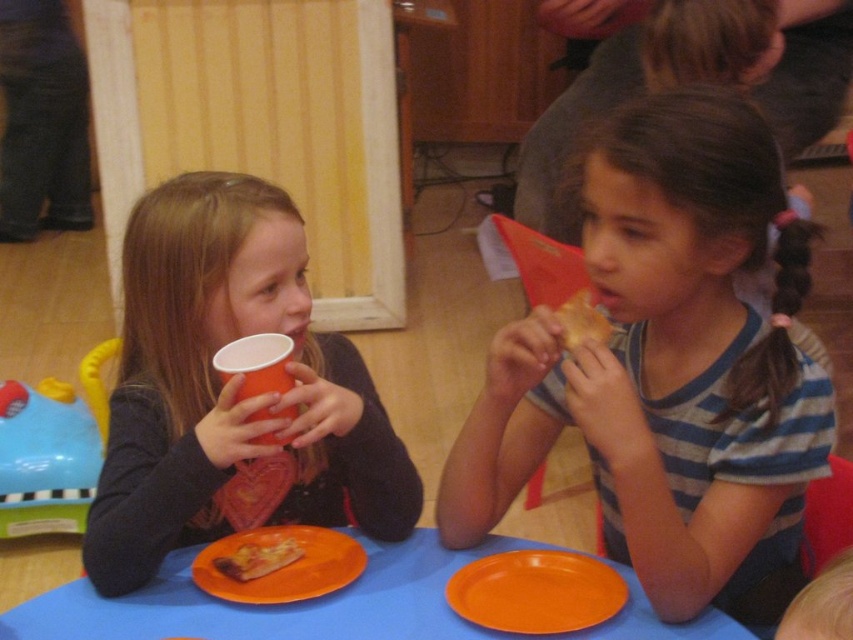
You are a parent trying to locate your child who dropped their orange plastic plate. The plate is at point (285, 566). Which child is sitting closest to that point?

The orange plastic plate at lower center is located at point (285, 566). Since the plate is at lower center, it is closer to the child on the right who is seated at the table and has their plate in front of them. Therefore, the child on the right is sitting closest to the orange plastic plate at lower center.

What is the position of the point labeled as point [326,605] in the image?

The point labeled as point [326,605] is located on the blue paper table at center.

You are a parent trying to decide which item to sanitize first. The matte plastic cup at left and the golden crispy pizza slice at lower center are both on the table. Which item has a greater width?

The matte plastic cup at left has a greater width than the golden crispy pizza slice at lower center.